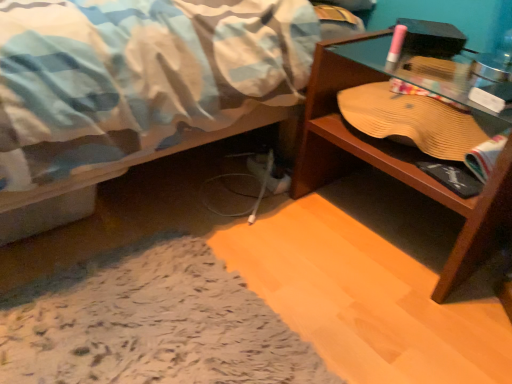
Question: From a real-world perspective, is transparent glass table at right under wooden desk at right?

Choices:
 (A) yes
 (B) no

Answer: (B)

Question: Is transparent glass table at right wider than wooden desk at right?

Choices:
 (A) no
 (B) yes

Answer: (A)

Question: Considering the relative sizes of transparent glass table at right and wooden desk at right in the image provided, is transparent glass table at right taller than wooden desk at right?

Choices:
 (A) no
 (B) yes

Answer: (A)

Question: Is transparent glass table at right positioned behind wooden desk at right?

Choices:
 (A) yes
 (B) no

Answer: (A)

Question: Is there a large distance between transparent glass table at right and wooden desk at right?

Choices:
 (A) yes
 (B) no

Answer: (B)

Question: Is transparent glass table at right to the right of wooden desk at right from the viewer's perspective?

Choices:
 (A) yes
 (B) no

Answer: (B)

Question: Considering the relative sizes of wooden desk at right and transparent glass table at right in the image provided, is wooden desk at right thinner than transparent glass table at right?

Choices:
 (A) yes
 (B) no

Answer: (B)

Question: Does wooden desk at right appear on the left side of transparent glass table at right?

Choices:
 (A) no
 (B) yes

Answer: (A)

Question: Can you confirm if wooden desk at right is smaller than transparent glass table at right?

Choices:
 (A) yes
 (B) no

Answer: (B)

Question: Could you tell me if wooden desk at right is turned towards transparent glass table at right?

Choices:
 (A) no
 (B) yes

Answer: (B)

Question: Is wooden desk at right not within transparent glass table at right?

Choices:
 (A) yes
 (B) no

Answer: (A)

Question: Considering the relative sizes of wooden desk at right and transparent glass table at right in the image provided, is wooden desk at right taller than transparent glass table at right?

Choices:
 (A) no
 (B) yes

Answer: (B)

Question: From the image's perspective, is wooden desk at right above or below transparent glass table at right?

Choices:
 (A) above
 (B) below

Answer: (B)